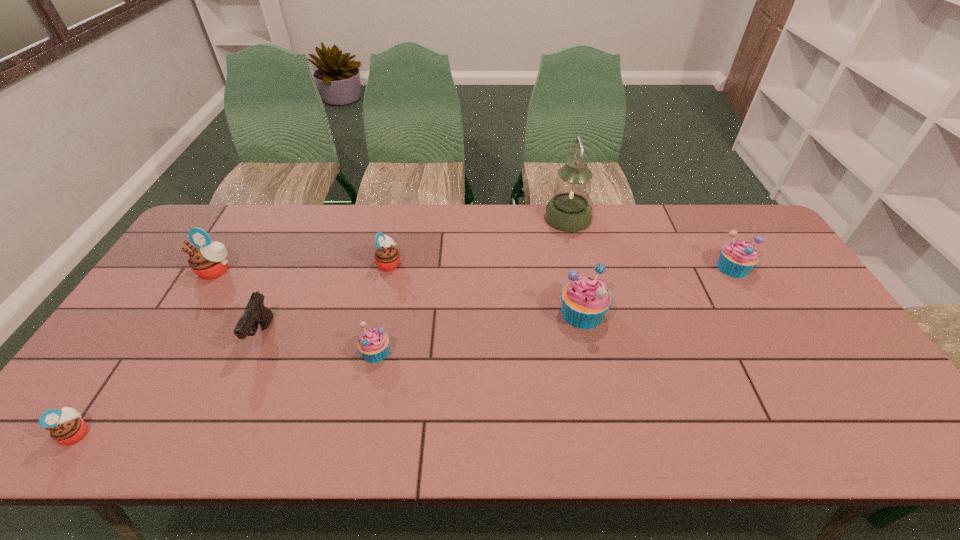
You are a GUI agent. You are given a task and a screenshot of the screen. Output one action in this format:
    pyautogui.click(x=<x>, y=<y>)
    Task: Click on the tallest object
    This screenshot has height=540, width=960.
    Given the screenshot: What is the action you would take?
    pyautogui.click(x=569, y=210)

Identify the location of the farthest object. (569, 210).

What are the coordinates of `the fourth farthest muffin` in the screenshot? It's located at (585, 301).

At what (x,y) coordinates should I click in order to perform the action: click on the biggest blue muffin. Please return your answer as a coordinate pair (x, y). Looking at the image, I should click on (585, 301).

Where is `the fifth muffin from right to left`? This screenshot has width=960, height=540. the fifth muffin from right to left is located at coordinates (208, 260).

The height and width of the screenshot is (540, 960). Find the location of `the second pink muffin from left to right`. the second pink muffin from left to right is located at coordinates (208, 260).

Where is `the second biggest pink muffin`? Image resolution: width=960 pixels, height=540 pixels. the second biggest pink muffin is located at coordinates (387, 257).

This screenshot has width=960, height=540. What are the coordinates of `the farthest blue muffin` in the screenshot? It's located at (737, 259).

Locate an element on the screen. This screenshot has width=960, height=540. the rightmost blue muffin is located at coordinates (737, 259).

You are a GUI agent. You are given a task and a screenshot of the screen. Output one action in this format:
    pyautogui.click(x=<x>, y=<y>)
    Task: Click on the black pistol
    
    Given the screenshot: What is the action you would take?
    pyautogui.click(x=255, y=313)